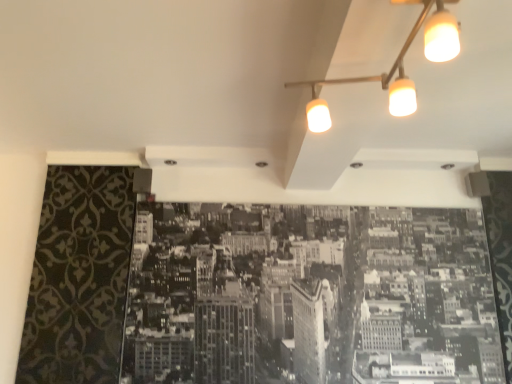
Question: Is matte white track light at upper right wider or thinner than monochrome paper cityscape at center?

Choices:
 (A) wide
 (B) thin

Answer: (A)

Question: Is matte white track light at upper right bigger or smaller than monochrome paper cityscape at center?

Choices:
 (A) small
 (B) big

Answer: (A)

Question: Would you say matte white track light at upper right is to the left or to the right of monochrome paper cityscape at center in the picture?

Choices:
 (A) right
 (B) left

Answer: (A)

Question: Is monochrome paper cityscape at center wider or thinner than matte white track light at upper right?

Choices:
 (A) wide
 (B) thin

Answer: (B)

Question: From the image's perspective, is monochrome paper cityscape at center positioned above or below matte white track light at upper right?

Choices:
 (A) below
 (B) above

Answer: (A)

Question: Visually, is monochrome paper cityscape at center positioned to the left or to the right of matte white track light at upper right?

Choices:
 (A) right
 (B) left

Answer: (B)

Question: Considering their positions, is monochrome paper cityscape at center located in front of or behind matte white track light at upper right?

Choices:
 (A) behind
 (B) front

Answer: (A)